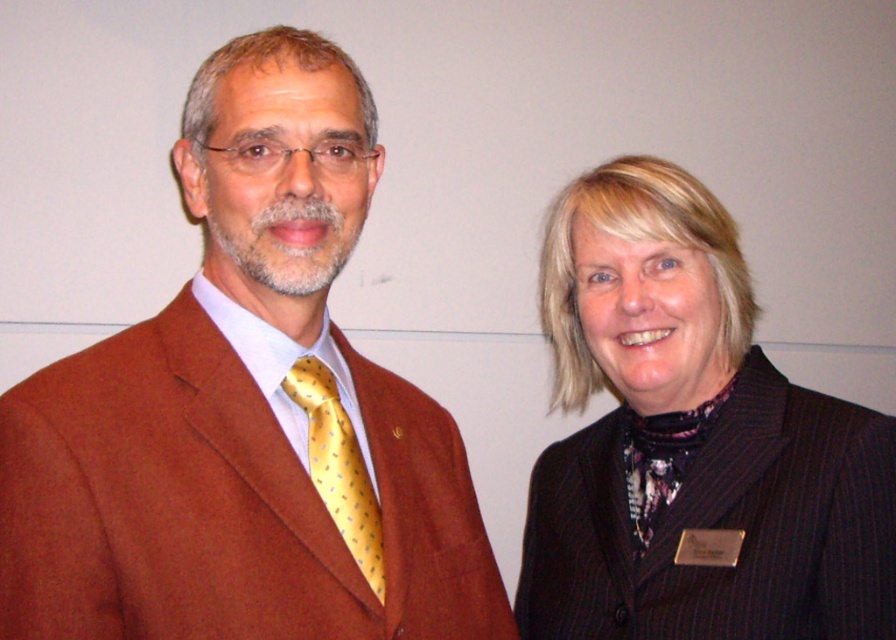
You are organizing a clothing donation drive and need to determine if the brown woolen suit at left and the yellow dotted silk tie at left can be paired together. Based on their widths, can the tie be properly worn with the suit?

The brown woolen suit at left is wider than the yellow dotted silk tie at left, so the tie can be properly worn with the suit as the suit provides enough width to accommodate the tie.

You are standing in front of two people in the image. The man on the left is wearing a rust blazer and the woman on the right is wearing a black pinstripe blazer at right. If you want to hand a document to the person whose blazer is located at point 0.692 in the x coordinate, which person should you approach?

The black pinstripe blazer at right is located at point 0.692 in the x coordinate, so you should approach the woman on the right.

Based on the photo, you are standing in front of the two people in the image. You need to place a small sticker exactly at the coordinates point (246, 412). Which person should you place it on?

The point (246, 412) is on the brown woolen suit at left, so you should place the sticker on the person on the left.